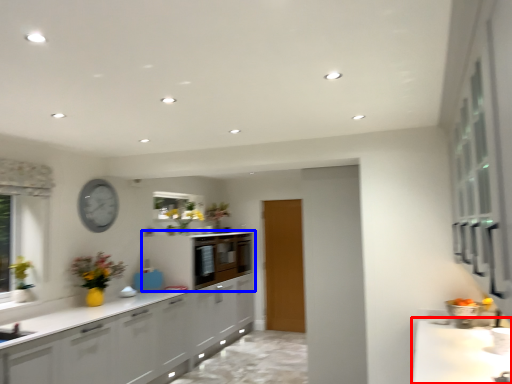
Question: Which object is closer to the camera taking this photo, countertop (highlighted by a red box) or cabinetry (highlighted by a blue box)?

Choices:
 (A) countertop
 (B) cabinetry

Answer: (A)